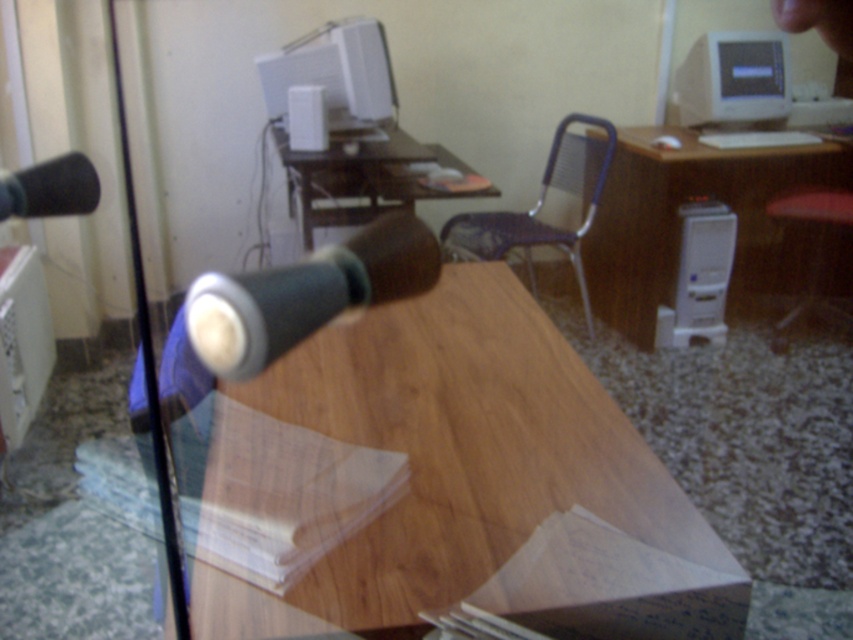
Does white plastic computer tower at center right appear on the right side of white glossy monitor at upper right?

Incorrect, white plastic computer tower at center right is not on the right side of white glossy monitor at upper right.

Does point (704, 182) lie behind point (689, 67)?

Yes, it is behind point (689, 67).

Find the location of `white plastic computer tower at center right`. white plastic computer tower at center right is located at coordinates (706, 224).

The image size is (853, 640). I want to click on white plastic computer tower at center right, so click(706, 224).

Is matte wood computer desk at center shorter than red cushioned stool at right?

Yes.

Which is below, matte wood computer desk at center or red cushioned stool at right?

red cushioned stool at right

Image resolution: width=853 pixels, height=640 pixels. I want to click on matte wood computer desk at center, so click(x=363, y=179).

Image resolution: width=853 pixels, height=640 pixels. What are the coordinates of `matte wood computer desk at center` in the screenshot? It's located at (363, 179).

Looking at this image, does white plastic computer tower at right have a lesser height compared to matte black speaker at upper center?

No, white plastic computer tower at right is not shorter than matte black speaker at upper center.

I want to click on white plastic computer tower at right, so click(700, 275).

This screenshot has height=640, width=853. In order to click on white plastic computer tower at right in this screenshot , I will do `click(700, 275)`.